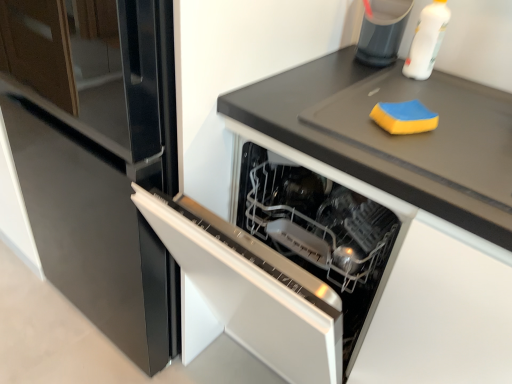
Question: Looking at their shapes, would you say black matte countertop at upper right is wider or thinner than translucent plastic container at upper right?

Choices:
 (A) wide
 (B) thin

Answer: (A)

Question: Is point (331, 144) closer or farther from the camera than point (378, 34)?

Choices:
 (A) farther
 (B) closer

Answer: (B)

Question: Which is nearer to the glossy black fridge at center?

Choices:
 (A) translucent plastic container at upper right
 (B) yellow sponge at upper right
 (C) black matte countertop at upper right
 (D) sleek stainless steel dishwasher at center
 (E) white plastic bottle at upper right

Answer: (D)

Question: Which is nearer to the white plastic bottle at upper right?

Choices:
 (A) glossy black fridge at center
 (B) sleek stainless steel dishwasher at center
 (C) black matte countertop at upper right
 (D) yellow sponge at upper right
 (E) translucent plastic container at upper right

Answer: (E)